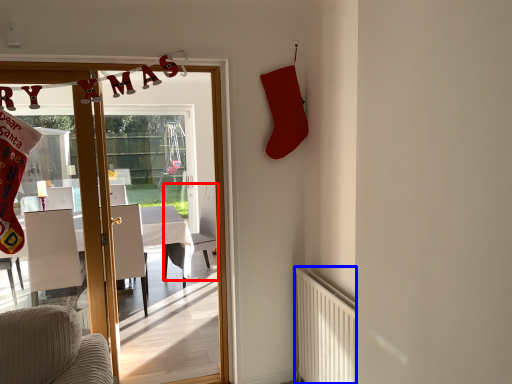
Question: Among these objects, which one is farthest to the camera, armchair (highlighted by a red box) or radiator (highlighted by a blue box)?

Choices:
 (A) armchair
 (B) radiator

Answer: (A)